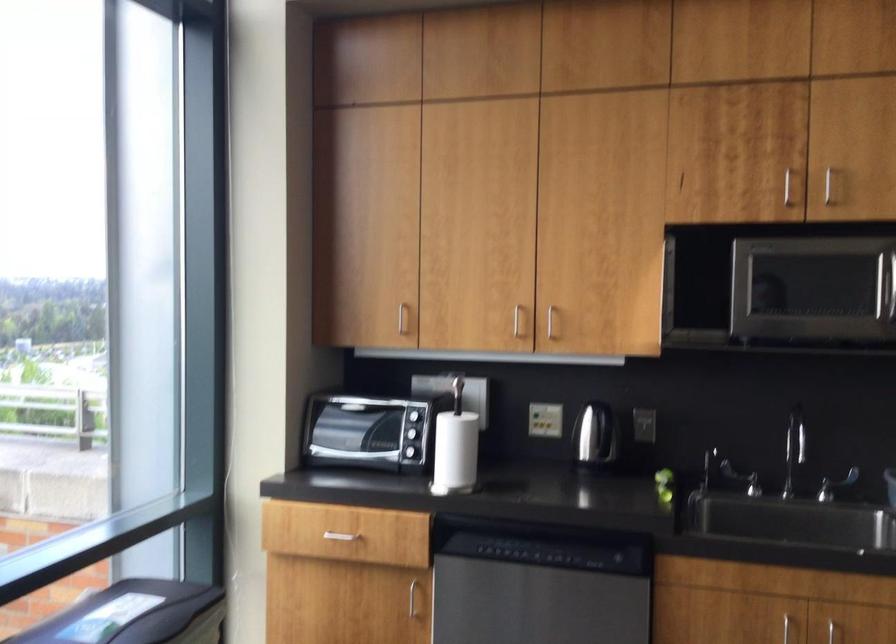
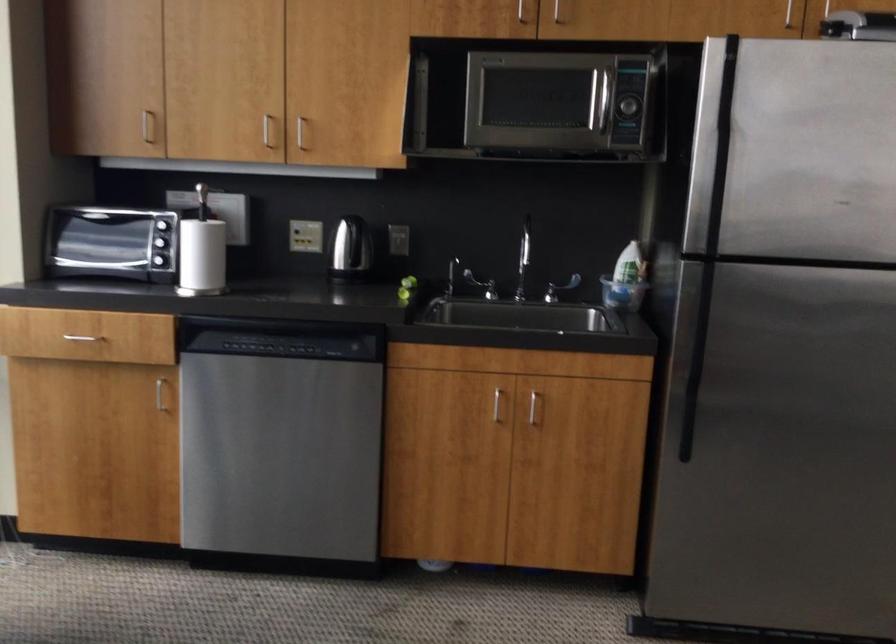
Where in the second image is the point corresponding to point 664,474 from the first image?

(409, 281)